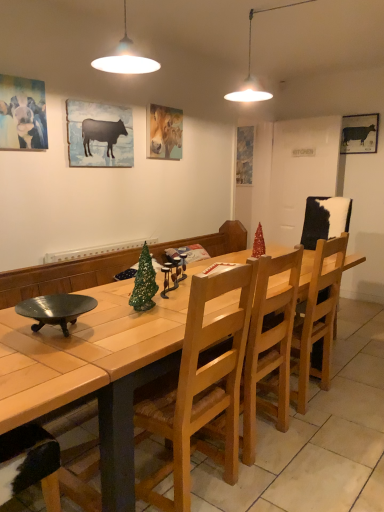
Question: Is light brown wood chair at center, which is the first chair from front to back, turned away from shiny red christmas tree at center?

Choices:
 (A) no
 (B) yes

Answer: (A)

Question: Is light brown wood chair at center, the first chair positioned from the left, positioned behind shiny red christmas tree at center?

Choices:
 (A) no
 (B) yes

Answer: (A)

Question: Is the depth of light brown wood chair at center, which appears as the second chair when viewed from the back, less than that of shiny red christmas tree at center?

Choices:
 (A) no
 (B) yes

Answer: (B)

Question: Is shiny red christmas tree at center a part of light brown wood chair at center, which appears as the second chair when viewed from the back?

Choices:
 (A) yes
 (B) no

Answer: (B)

Question: Considering the positions of silhouette paper cow at upper left, the 4th picture frame in the right-to-left sequence, and black matte cow at upper right, which is counted as the second picture frame, starting from the back, in the image, is silhouette paper cow at upper left, the 4th picture frame in the right-to-left sequence, bigger or smaller than black matte cow at upper right, which is counted as the second picture frame, starting from the back,?

Choices:
 (A) small
 (B) big

Answer: (B)

Question: In the image, is silhouette paper cow at upper left, acting as the second picture frame starting from the front, on the left side or the right side of black matte cow at upper right, the fourth picture frame viewed from the front?

Choices:
 (A) left
 (B) right

Answer: (A)

Question: Is silhouette paper cow at upper left, which is counted as the fourth picture frame, starting from the back, in front of or behind black matte cow at upper right, which is counted as the 5th picture frame, starting from the left, in the image?

Choices:
 (A) behind
 (B) front

Answer: (B)

Question: Considering the positions of silhouette paper cow at upper left, acting as the second picture frame starting from the front, and black matte cow at upper right, the fourth picture frame viewed from the front, in the image, is silhouette paper cow at upper left, acting as the second picture frame starting from the front, wider or thinner than black matte cow at upper right, the fourth picture frame viewed from the front,?

Choices:
 (A) thin
 (B) wide

Answer: (A)

Question: From a real-world perspective, is pastel oil painting of horse at upper center, the third picture frame viewed from the back, above or below wooden table at center?

Choices:
 (A) below
 (B) above

Answer: (B)

Question: From the image's perspective, is pastel oil painting of horse at upper center, acting as the third picture frame starting from the left, positioned above or below wooden table at center?

Choices:
 (A) below
 (B) above

Answer: (B)

Question: In terms of size, does pastel oil painting of horse at upper center, which ranks as the 3th picture frame in front-to-back order, appear bigger or smaller than wooden table at center?

Choices:
 (A) big
 (B) small

Answer: (B)

Question: Is pastel oil painting of horse at upper center, the 3th picture frame viewed from the right, taller or shorter than wooden table at center?

Choices:
 (A) short
 (B) tall

Answer: (A)

Question: Considering the positions of point click(x=251, y=139) and point click(x=309, y=289), is point click(x=251, y=139) closer or farther from the camera than point click(x=309, y=289)?

Choices:
 (A) farther
 (B) closer

Answer: (A)

Question: Is matte blue painting at center, arranged as the 5th picture frame when viewed from the front, spatially inside wooden chair at center, the 1th chair when ordered from right to left, or outside of it?

Choices:
 (A) outside
 (B) inside

Answer: (A)